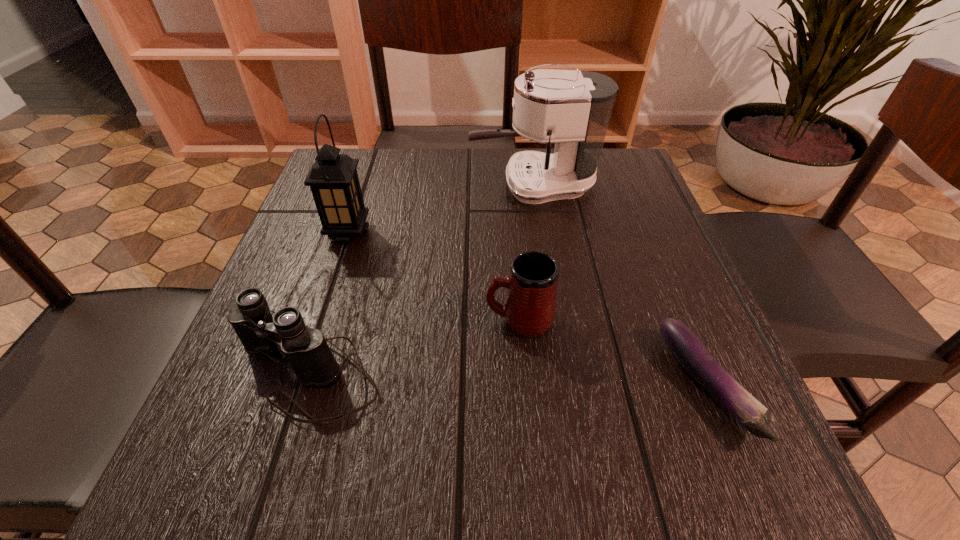
At what (x,y) coordinates should I click in order to perform the action: click on the farthest object. Please return your answer as a coordinate pair (x, y). Looking at the image, I should click on (571, 108).

Identify the location of lantern. This screenshot has width=960, height=540. (333, 179).

At what (x,y) coordinates should I click in order to perform the action: click on mug. Please return your answer as a coordinate pair (x, y). Looking at the image, I should click on (529, 310).

At what (x,y) coordinates should I click in order to perform the action: click on binoculars. Please return your answer as a coordinate pair (x, y). Looking at the image, I should click on (306, 353).

Where is `the rightmost object`? Image resolution: width=960 pixels, height=540 pixels. the rightmost object is located at coordinates (690, 352).

The image size is (960, 540). I want to click on the shortest object, so click(x=690, y=352).

Locate an element on the screen. The height and width of the screenshot is (540, 960). vacant space located on the front-facing side of the farthest object is located at coordinates (348, 185).

I want to click on vacant area located 0.260m on the front-facing side of the farthest object, so click(356, 185).

This screenshot has width=960, height=540. I want to click on free space located on the front-facing side of the farthest object, so click(426, 185).

Locate an element on the screen. The width and height of the screenshot is (960, 540). blank space located 0.140m on the right of the lantern is located at coordinates (439, 233).